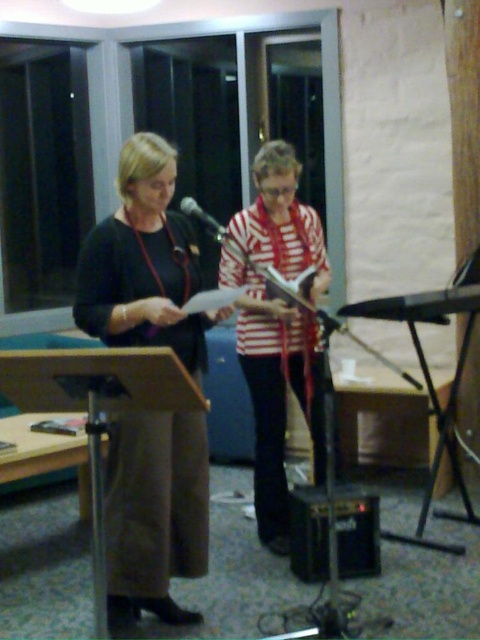
You are a photographer positioned in front of the scene. You want to take a closeup shot of the matte black dress at center without the black matte microphone at center appearing in the frame. Is this possible given their positions?

The matte black dress at center is closer to the viewer than the black matte microphone at center, so it is possible to take a closeup shot of the matte black dress at center without the microphone appearing in the frame by focusing on the dress and adjusting the camera angle to exclude the microphone.

You are a stagehand setting up for a presentation. You need to place a 24 inch wide prop between the striped fabric at center and the black matte microphone at center. Will there be enough space?

The distance between the striped fabric at center and the black matte microphone at center is 24.01 inches, so a 24 inch wide prop can fit between them with a slight gap of 0.01 inches remaining.

You are standing at the point marked as point (119, 456) in the room. You want to move to the door that is directly opposite the large darkened windows. Can you reach the door without moving more than 8 feet from your current position?

The distance between you and the viewer is 7.71 feet, which is less than 8 feet. Therefore, you can reach the door without moving more than 8 feet from your current position.